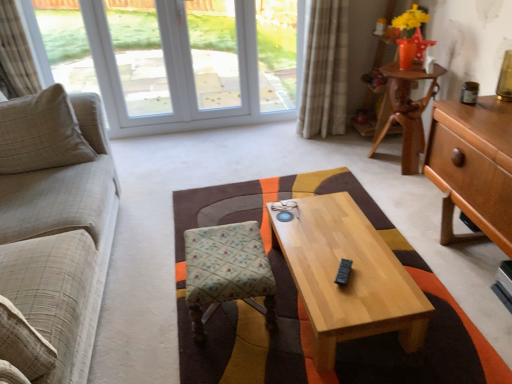
Identify the location of free region on the left part of light wood/texture coffee table at center. This screenshot has height=384, width=512. (179, 316).